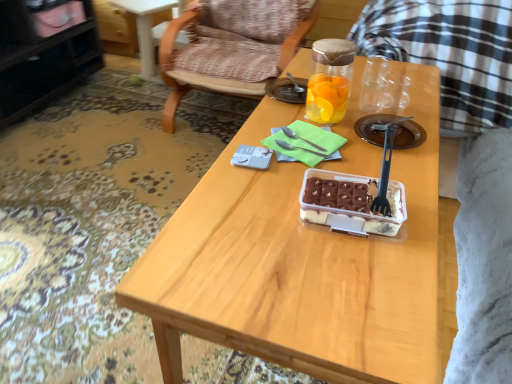
Identify the location of free spot behind black plastic fork at center, which is the first fork in front-to-back order. This screenshot has height=384, width=512. (375, 164).